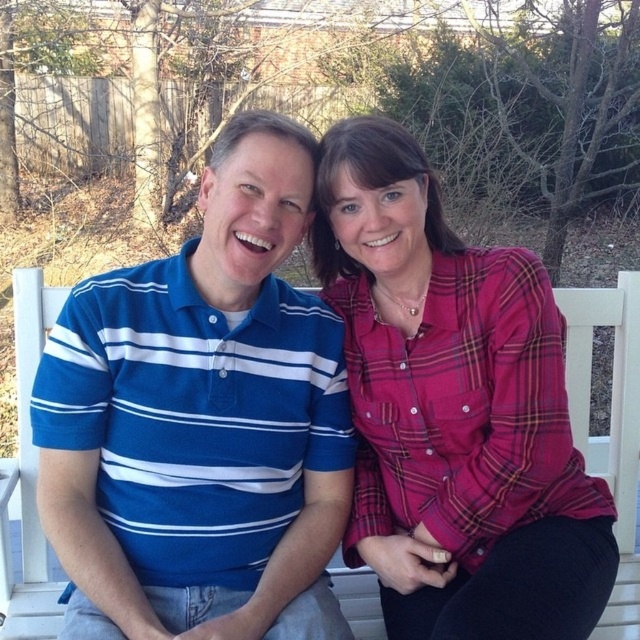
Can you confirm if blue striped polo shirt at left is thinner than plaid fabric shirt at center?

No.

Who is lower down, blue striped polo shirt at left or plaid fabric shirt at center?

plaid fabric shirt at center is lower down.

Locate an element on the screen. Image resolution: width=640 pixels, height=640 pixels. blue striped polo shirt at left is located at coordinates (202, 420).

You are a GUI agent. You are given a task and a screenshot of the screen. Output one action in this format:
    pyautogui.click(x=<x>, y=<y>)
    Task: Click on the blue striped polo shirt at left
    This screenshot has height=640, width=640.
    Given the screenshot: What is the action you would take?
    pyautogui.click(x=202, y=420)